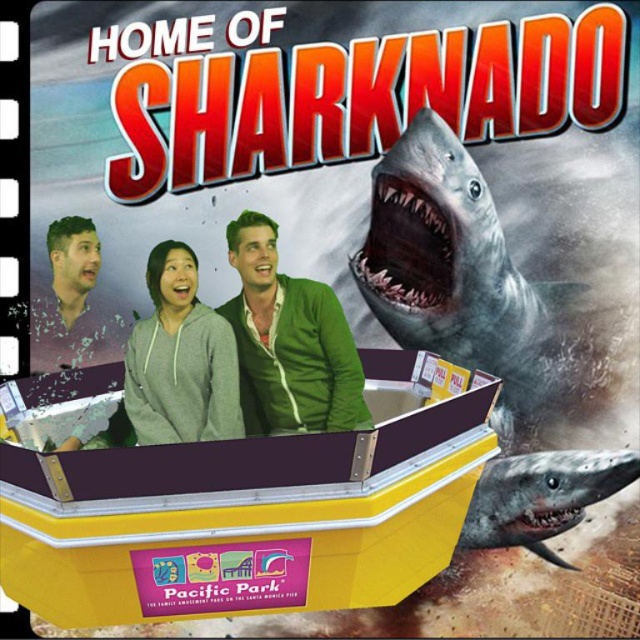
Question: Is the position of green cardigan at center more distant than that of gray fleece sweatshirt at center?

Choices:
 (A) no
 (B) yes

Answer: (B)

Question: Among these objects, which one is nearest to the camera?

Choices:
 (A) gray textured shark at right
 (B) green cardigan at center
 (C) gray fleece sweatshirt at center

Answer: (C)

Question: Which point is closer to the camera taking this photo?

Choices:
 (A) (189, 260)
 (B) (99, 316)
 (C) (422, 317)
 (D) (314, 380)

Answer: (A)

Question: Is gray textured shark at right below gray fleece sweatshirt at center?

Choices:
 (A) no
 (B) yes

Answer: (B)

Question: Among these points, which one is farthest from the camera?

Choices:
 (A) (470, 259)
 (B) (196, 378)
 (C) (97, 278)
 (D) (336, 342)

Answer: (C)

Question: Does gray textured shark at right appear over gray fleece sweatshirt at center?

Choices:
 (A) yes
 (B) no

Answer: (B)